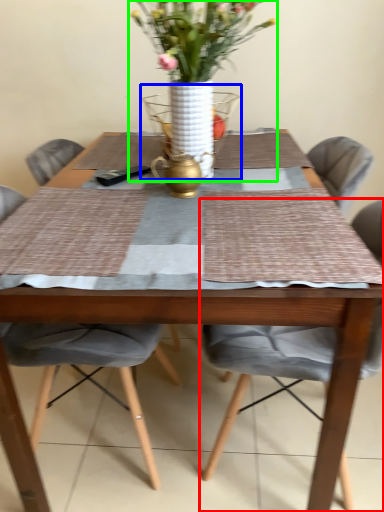
Question: Which object is positioned closest to chair (highlighted by a red box)? Select from glass vase (highlighted by a blue box) and houseplant (highlighted by a green box).

Choices:
 (A) glass vase
 (B) houseplant

Answer: (B)